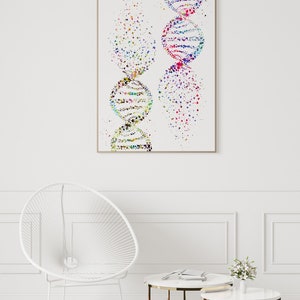
You are a GUI agent. You are given a task and a screenshot of the screen. Output one action in this format:
    pyautogui.click(x=<x>, y=<y>)
    Task: Click on the canvas
    
    Given the screenshot: What is the action you would take?
    pyautogui.click(x=209, y=144)